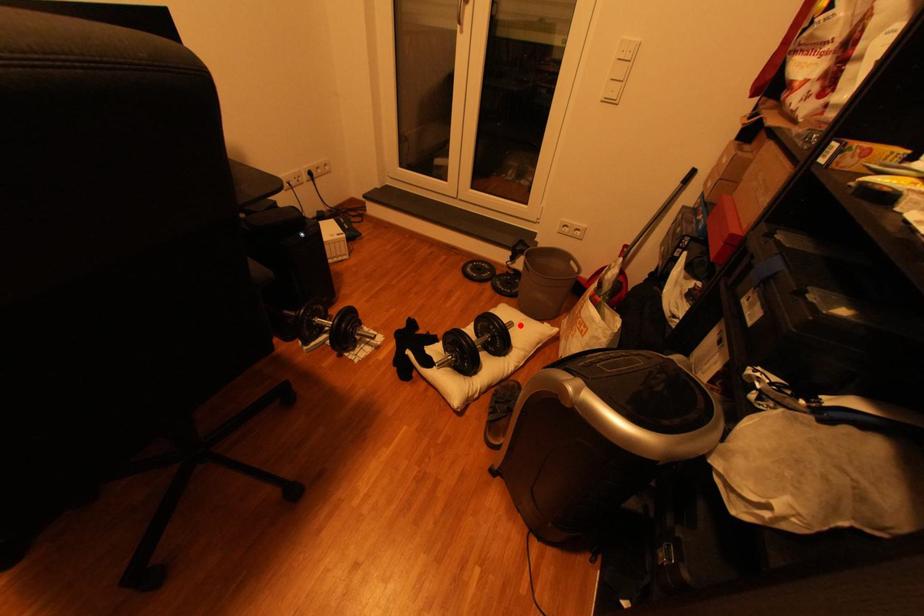
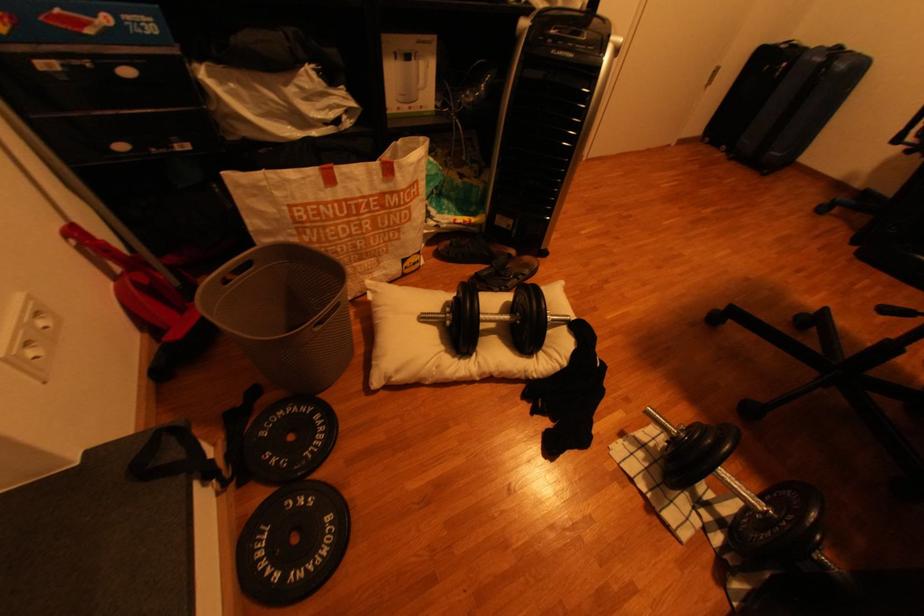
The point at the highlighted location is marked in the first image. Where is the corresponding point in the second image?

(433, 318)